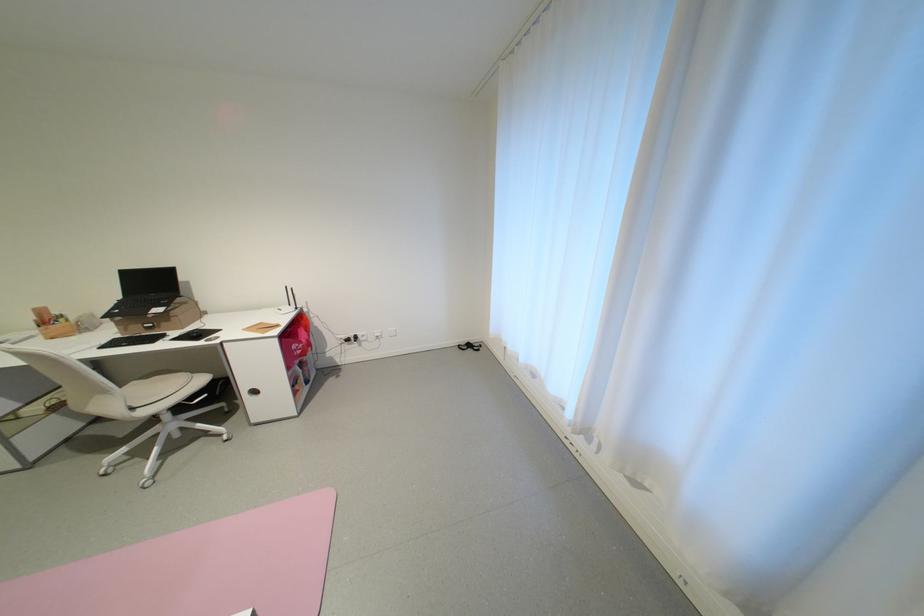
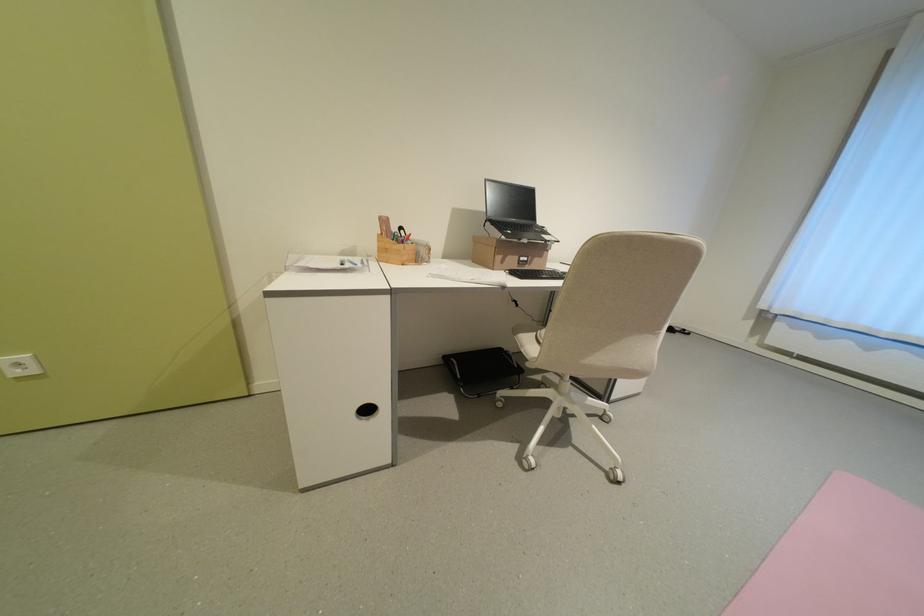
Locate, in the second image, the point that corresponds to point 127,312 in the first image.

(518, 233)